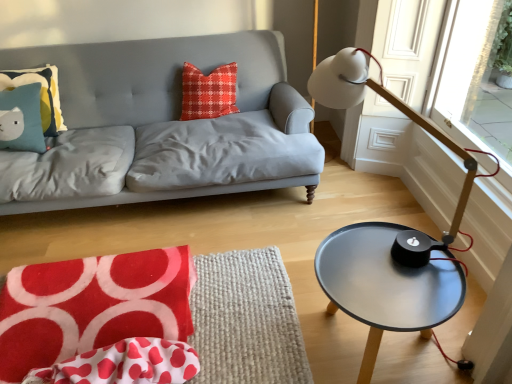
Question: Is red plaid pillow at center, which is the 2th pillow in left-to-right order, bigger or smaller than metallic gray table at right?

Choices:
 (A) big
 (B) small

Answer: (B)

Question: Is red plaid pillow at center, the first pillow positioned from the right, situated inside metallic gray table at right or outside?

Choices:
 (A) outside
 (B) inside

Answer: (A)

Question: Estimate the real-world distances between objects in this image. Which object is closer to the white matte table lamp at right?

Choices:
 (A) metallic gray table at right
 (B) matte gray fabric couch at upper left
 (C) red plaid pillow at center, the first pillow positioned from the right
 (D) white polka dot fabric at lower left
 (E) matte blue pillow with cat design at upper left, which is the second pillow from right to left

Answer: (A)

Question: Based on their relative distances, which object is nearer to the red plaid pillow at center, the first pillow positioned from the right?

Choices:
 (A) matte blue pillow with cat design at upper left, which is the first pillow in left-to-right order
 (B) white matte table lamp at right
 (C) matte gray fabric couch at upper left
 (D) white polka dot fabric at lower left
 (E) velvety red swivel chair at lower left

Answer: (C)